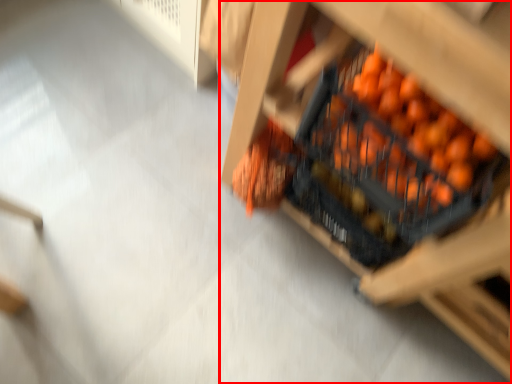
Question: From the image's perspective, what is the correct spatial positioning of furniture (annotated by the red box) in reference to fruit?

Choices:
 (A) above
 (B) below

Answer: (A)